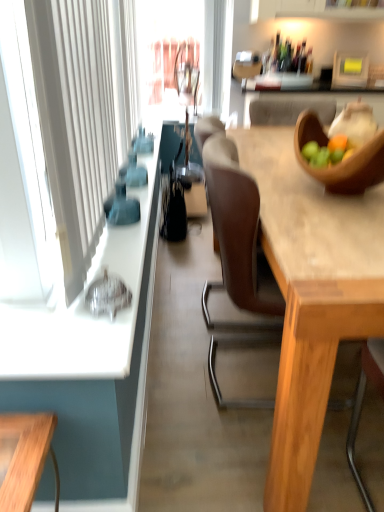
The width and height of the screenshot is (384, 512). Identify the location of free spot in front of wooden bowl at upper right. (336, 225).